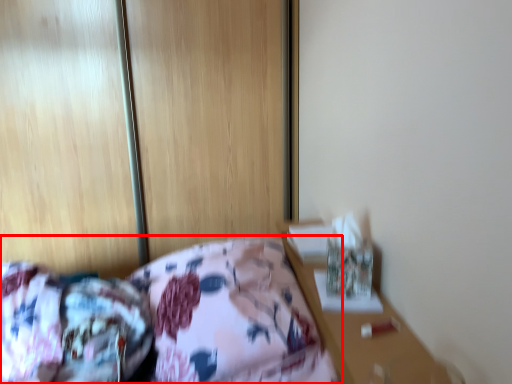
Question: From the image's perspective, where is bed (annotated by the red box) located in relation to mattress in the image?

Choices:
 (A) below
 (B) above

Answer: (B)